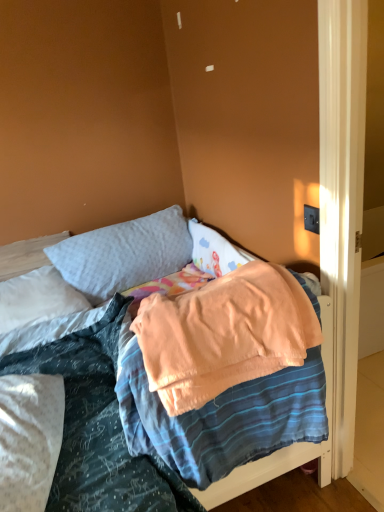
Question: Do you think soft gray pillow at upper center, the 1th pillow viewed from the right, is within soft peach blanket at center, or outside of it?

Choices:
 (A) outside
 (B) inside

Answer: (A)

Question: From their relative heights in the image, would you say soft gray pillow at upper center, the 1th pillow viewed from the right, is taller or shorter than soft peach blanket at center?

Choices:
 (A) short
 (B) tall

Answer: (A)

Question: Which of these objects is positioned closest to the white soft pillow at upper left, which appears as the first pillow when viewed from the left?

Choices:
 (A) soft peach blanket at center
 (B) soft gray pillow at upper center, which is the second pillow from left to right

Answer: (B)

Question: Estimate the real-world distances between objects in this image. Which object is closer to the soft peach blanket at center?

Choices:
 (A) soft gray pillow at upper center, the 1th pillow viewed from the right
 (B) white soft pillow at upper left, which appears as the second pillow when viewed from the right

Answer: (B)